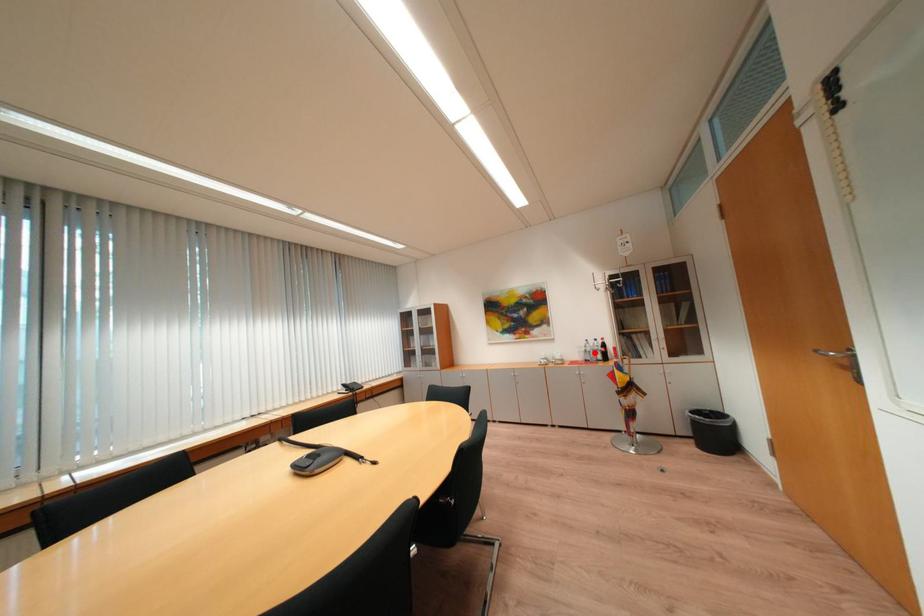
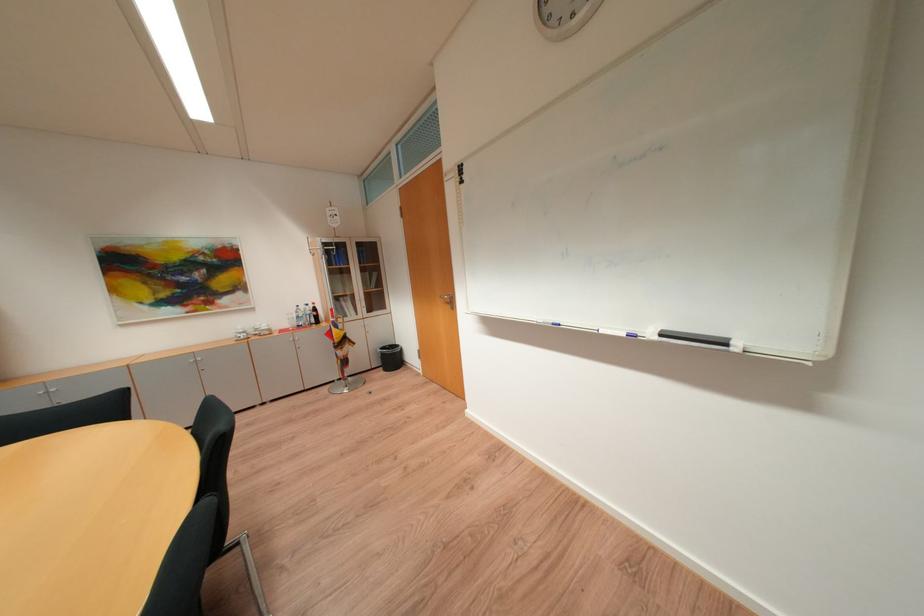
Question: I am providing you with two images of the same scene from different viewpoints. In image1, a red point is highlighted. Considering the same 3D point in image2, which of the following is correct?

Choices:
 (A) It is closer
 (B) It is farther

Answer: (A)